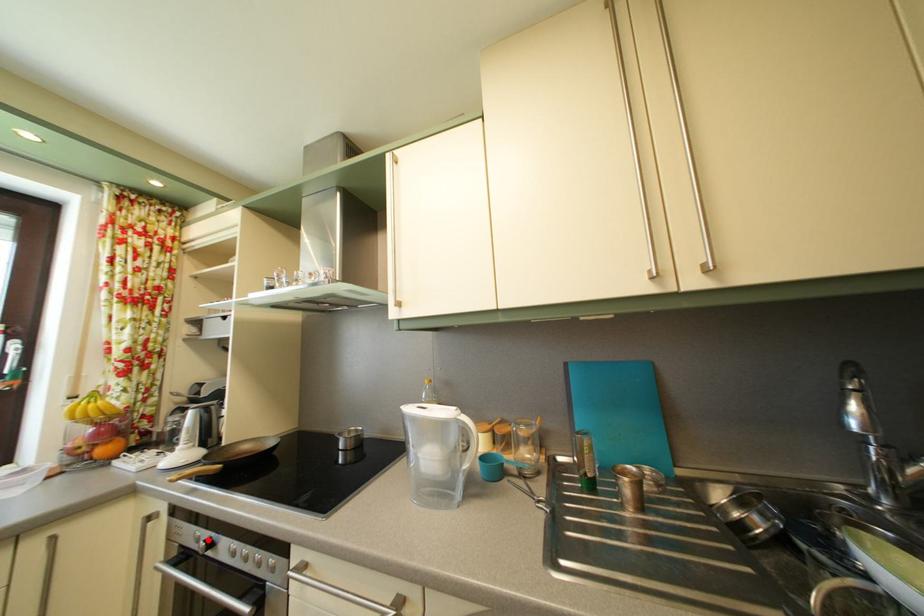
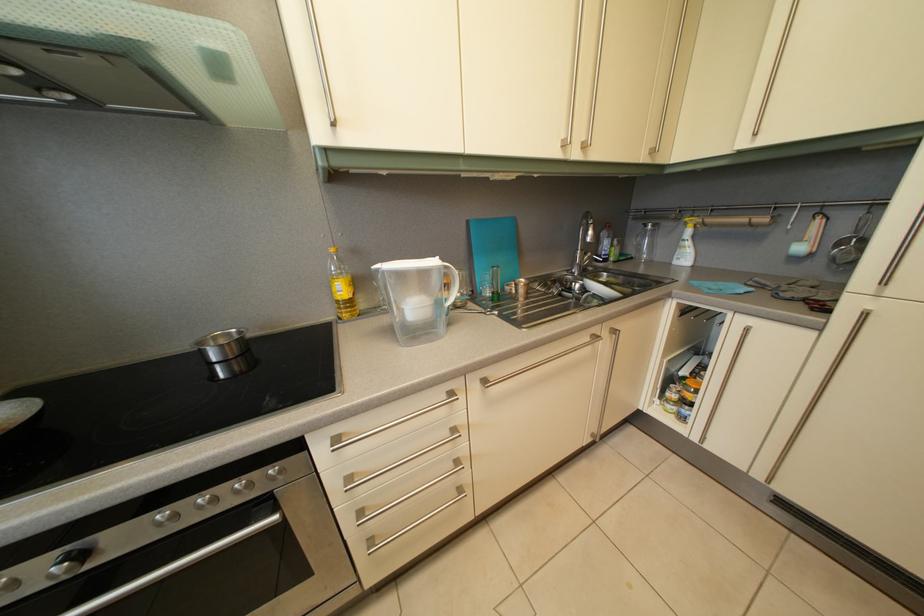
Question: I am providing you with two images of the same scene from different viewpoints. Image1 has a red point marked. In image2, the corresponding 3D location appears at what relative position? Reply with the corresponding letter.

Choices:
 (A) Closer
 (B) Farther

Answer: (B)